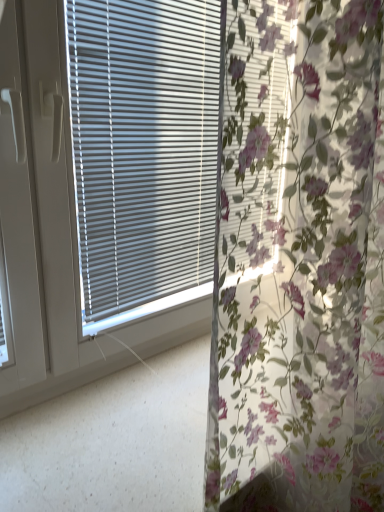
Question: Considering their positions, is matte gray blinds at center located in front of or behind floral fabric curtain at center?

Choices:
 (A) behind
 (B) front

Answer: (A)

Question: Looking at their shapes, would you say matte gray blinds at center is wider or thinner than floral fabric curtain at center?

Choices:
 (A) wide
 (B) thin

Answer: (B)

Question: Considering the positions of matte gray blinds at center and floral fabric curtain at center in the image, is matte gray blinds at center bigger or smaller than floral fabric curtain at center?

Choices:
 (A) big
 (B) small

Answer: (B)

Question: From a real-world perspective, is floral fabric curtain at center above or below matte gray blinds at center?

Choices:
 (A) below
 (B) above

Answer: (A)

Question: In the image, is floral fabric curtain at center positioned in front of or behind matte gray blinds at center?

Choices:
 (A) front
 (B) behind

Answer: (A)

Question: Visually, is floral fabric curtain at center positioned to the left or to the right of matte gray blinds at center?

Choices:
 (A) left
 (B) right

Answer: (B)

Question: Is floral fabric curtain at center spatially inside matte gray blinds at center, or outside of it?

Choices:
 (A) outside
 (B) inside

Answer: (A)